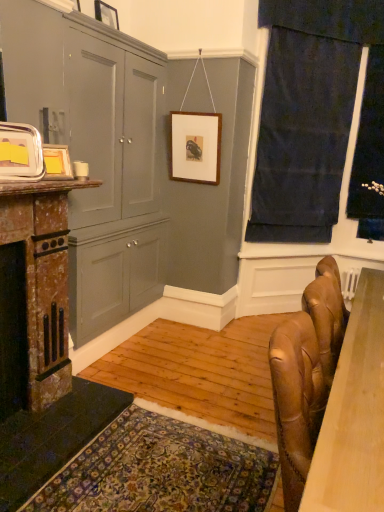
Locate an element on the screen. The height and width of the screenshot is (512, 384). vacant space situated above wooden picture frame at center, the 3th picture frame ordered from the bottom (from a real-world perspective) is located at coordinates (190, 113).